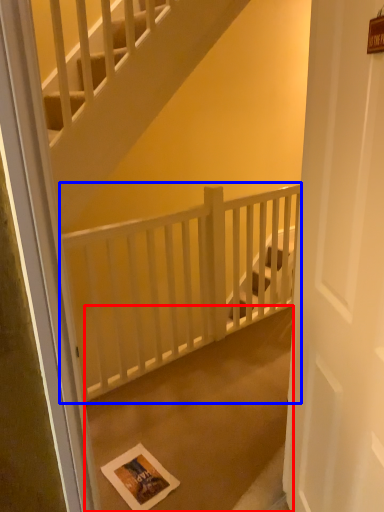
Question: Which of the following is the farthest to the observer, concrete (highlighted by a red box) or balustrade (highlighted by a blue box)?

Choices:
 (A) concrete
 (B) balustrade

Answer: (B)